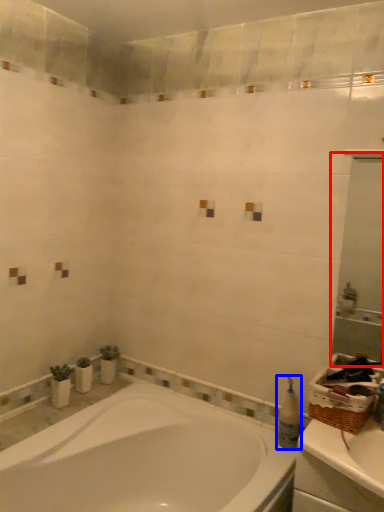
Question: Which point is further to the camera, mirror (highlighted by a red box) or toiletry (highlighted by a blue box)?

Choices:
 (A) mirror
 (B) toiletry

Answer: (B)